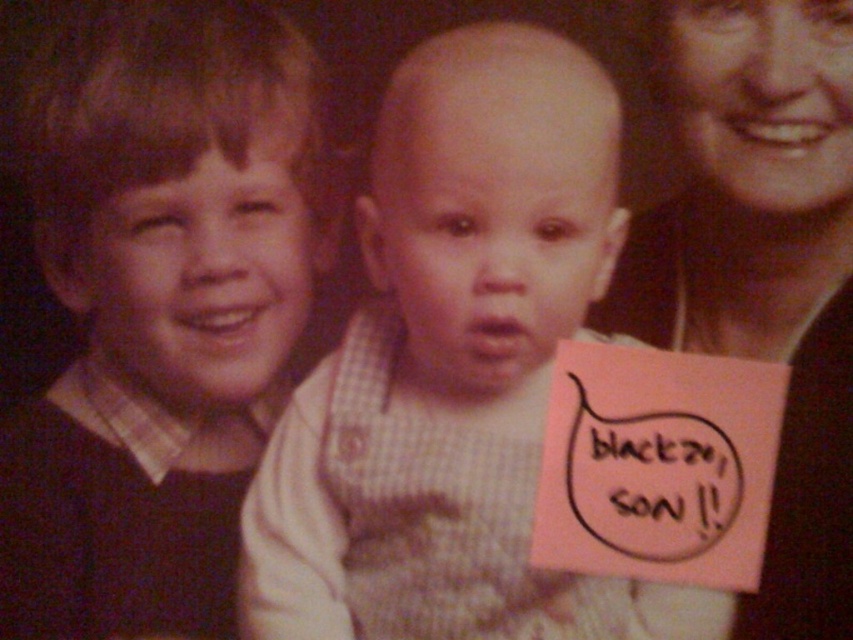
Question: In this image, where is matte black sweater at left located relative to smooth skin face at upper right?

Choices:
 (A) above
 (B) below

Answer: (B)

Question: Which point is farther to the camera?

Choices:
 (A) smooth skin face at upper right
 (B) checkered fabric shirt at center
 (C) matte black sweater at left

Answer: (C)

Question: Can you confirm if checkered fabric shirt at center is positioned to the right of smooth skin face at upper right?

Choices:
 (A) no
 (B) yes

Answer: (A)

Question: Which object appears farthest from the camera in this image?

Choices:
 (A) smooth skin face at upper right
 (B) checkered fabric shirt at center
 (C) matte black sweater at left

Answer: (C)

Question: Is the position of checkered fabric shirt at center more distant than that of matte black sweater at left?

Choices:
 (A) no
 (B) yes

Answer: (A)

Question: Based on their relative distances, which object is nearer to the checkered fabric shirt at center?

Choices:
 (A) smooth skin face at upper right
 (B) matte black sweater at left

Answer: (A)